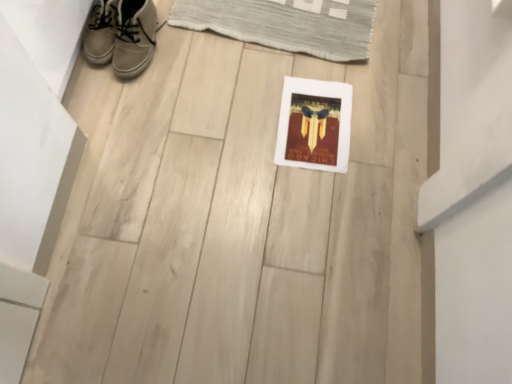
Locate an element on the screen. Image resolution: width=512 pixels, height=384 pixels. free space between white leather sneakers at upper left, the first footwear in the right-to-left sequence, and white matte picture frame at center is located at coordinates pyautogui.click(x=221, y=82).